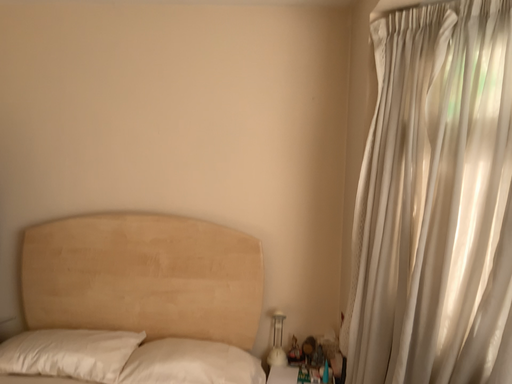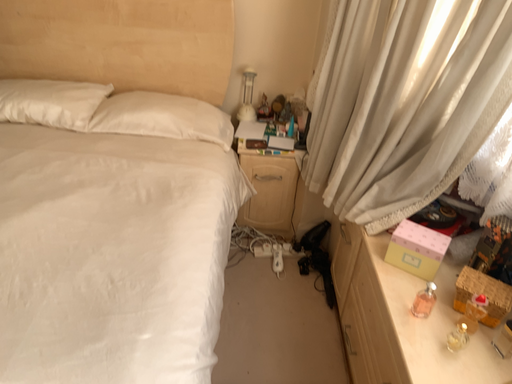
Question: How did the camera likely rotate when shooting the video?

Choices:
 (A) rotated upward
 (B) rotated downward

Answer: (B)